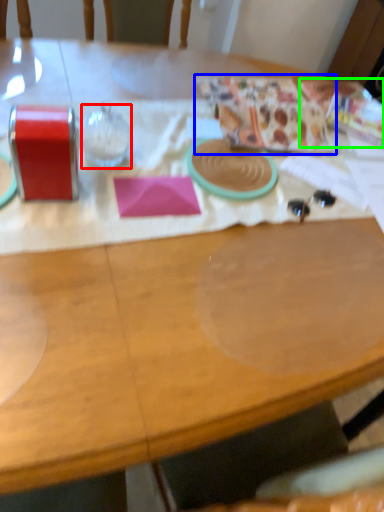
Question: Estimate the real-world distances between objects in this image. Which object is farther from wine glass (highlighted by a red box), wrapping paper (highlighted by a blue box) or wrapping paper (highlighted by a green box)?

Choices:
 (A) wrapping paper
 (B) wrapping paper

Answer: (B)